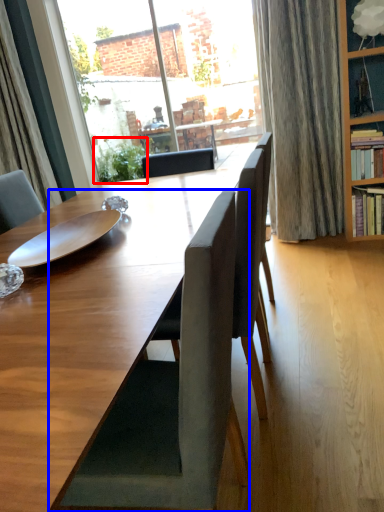
Question: Which object is closer to the camera taking this photo, plant (highlighted by a red box) or chair (highlighted by a blue box)?

Choices:
 (A) plant
 (B) chair

Answer: (B)